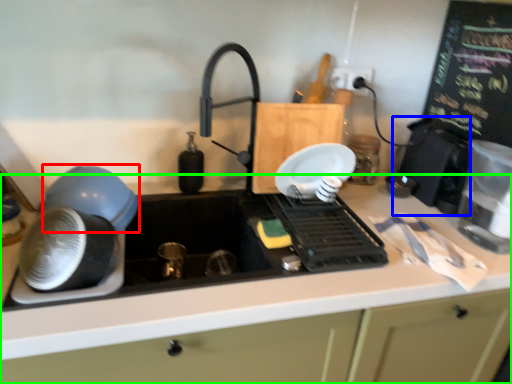
Question: Considering the real-world distances, which object is farthest from kitchen appliance (highlighted by a red box)? appliance (highlighted by a blue box) or countertop (highlighted by a green box)?

Choices:
 (A) appliance
 (B) countertop

Answer: (A)